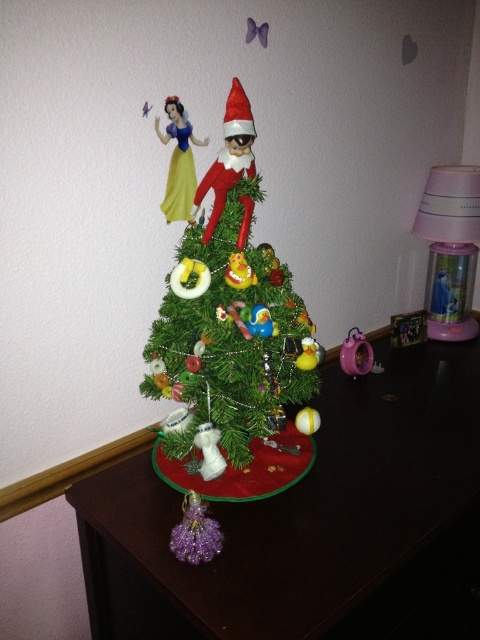
You are a guest at a Christmas party and notice the green matte christmas tree at center and the yellow satin dress at upper left. Which object is positioned higher in the image?

The yellow satin dress at upper left is positioned higher than the green matte christmas tree at center.

You are standing in front of the Christmas tree and want to place a gift box on the dark brown wooden table at center. Based on the coordinates provided, where exactly should you place the gift box?

The gift box should be placed at the coordinates point (313, 524), which is the location of the dark brown wooden table at center.

You are standing in front of the Christmas tree and want to place a small ornament. You have two points marked on the tree where you can place it. The first point is at coordinate point(261, 429) and the second is at point(160, 205). Which point is closer to you?

Point(261, 429) is closer to the camera than point(160, 205), so you should choose that point as it is closer to you.